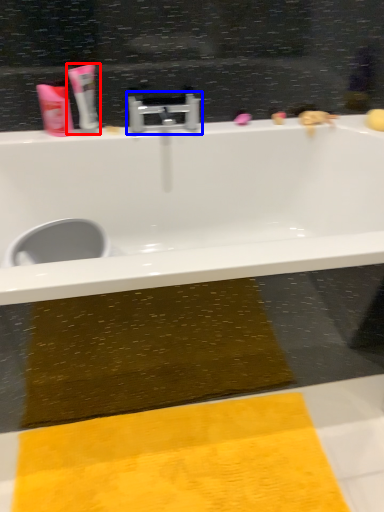
Question: Which point is further to the camera, toothpaste (highlighted by a red box) or tap (highlighted by a blue box)?

Choices:
 (A) toothpaste
 (B) tap

Answer: (B)